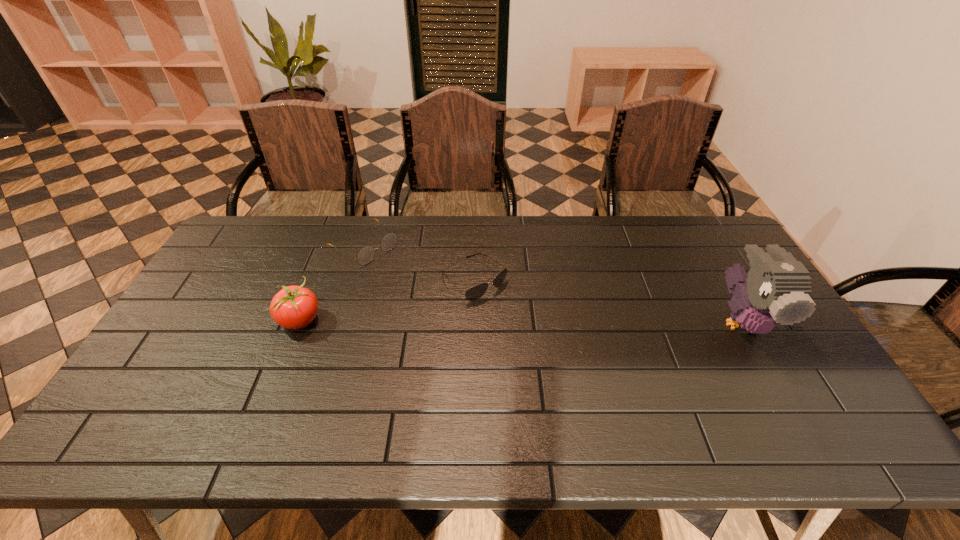
Locate an element on the screen. This screenshot has height=540, width=960. free spot on the desktop that is between the tomato and the bird and is positioned on the temples of the spectacles is located at coordinates (470, 321).

Locate an element on the screen. Image resolution: width=960 pixels, height=540 pixels. vacant spot on the desktop that is between the tomato and the bird and is positioned on the front-facing side of the third object from left to right is located at coordinates (522, 321).